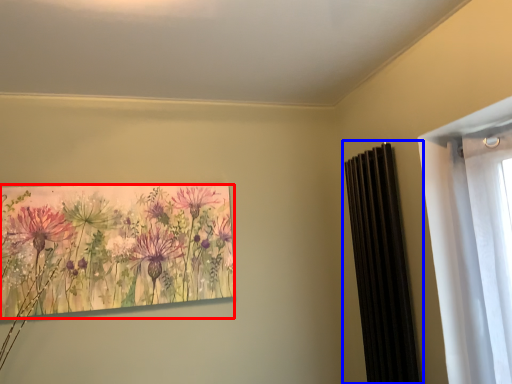
Question: Which of the following is the farthest to the observer, flower (highlighted by a red box) or radiator (highlighted by a blue box)?

Choices:
 (A) flower
 (B) radiator

Answer: (A)